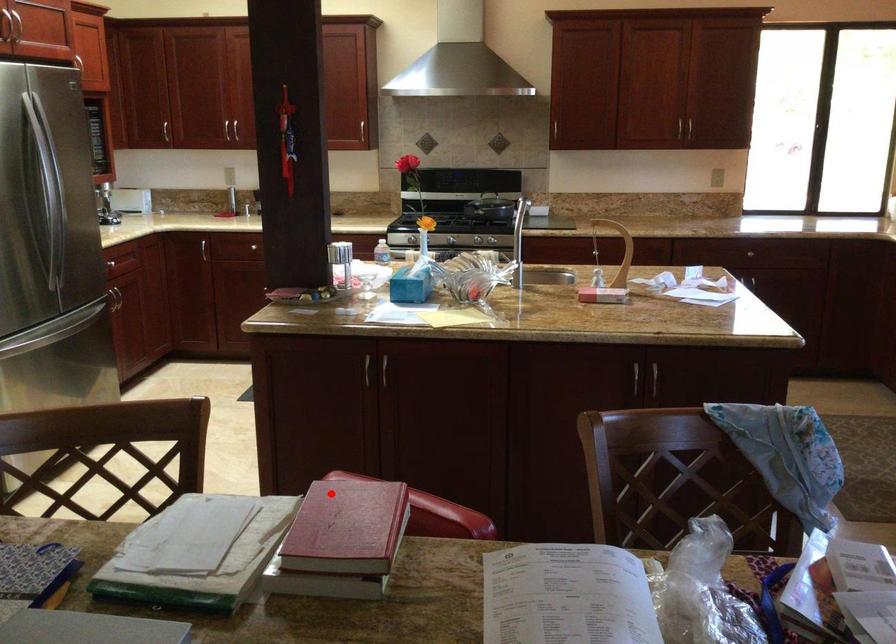
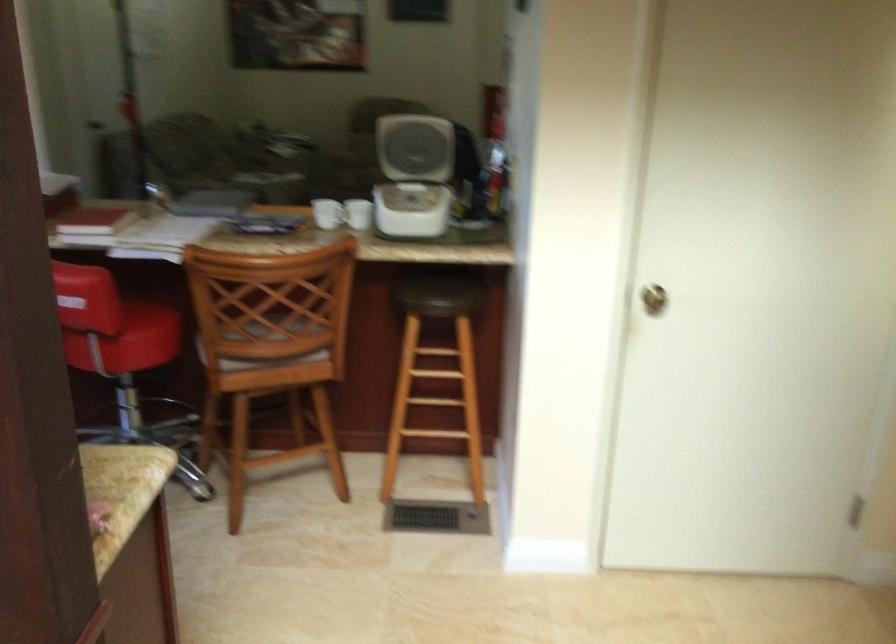
Where in the second image is the point corresponding to the highlighted location from the first image?

(93, 223)